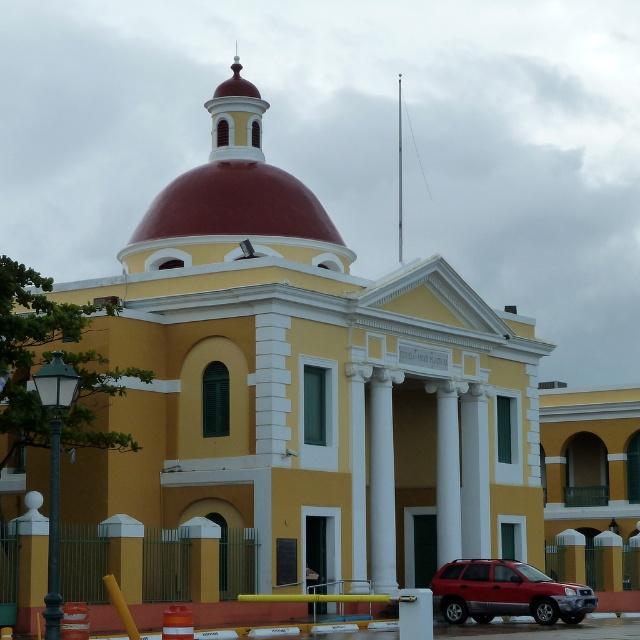
Question: Which point is closer to the camera?

Choices:
 (A) (385, 525)
 (B) (508, 609)

Answer: (B)

Question: Where is white marble column at center located in relation to smooth red dome at upper center in the image?

Choices:
 (A) right
 (B) left

Answer: (A)

Question: Observing the image, what is the correct spatial positioning of metallic red suv at lower right in reference to white marble column at center?

Choices:
 (A) above
 (B) below

Answer: (B)

Question: Which point is farther from the camera taking this photo?

Choices:
 (A) (497, 570)
 (B) (228, 150)

Answer: (B)

Question: Can you confirm if white marble column at center is wider than smooth red dome at upper center?

Choices:
 (A) no
 (B) yes

Answer: (A)

Question: Which of these objects is positioned farthest from the metallic red suv at lower right?

Choices:
 (A) smooth red dome at upper center
 (B) white marble column at center

Answer: (A)